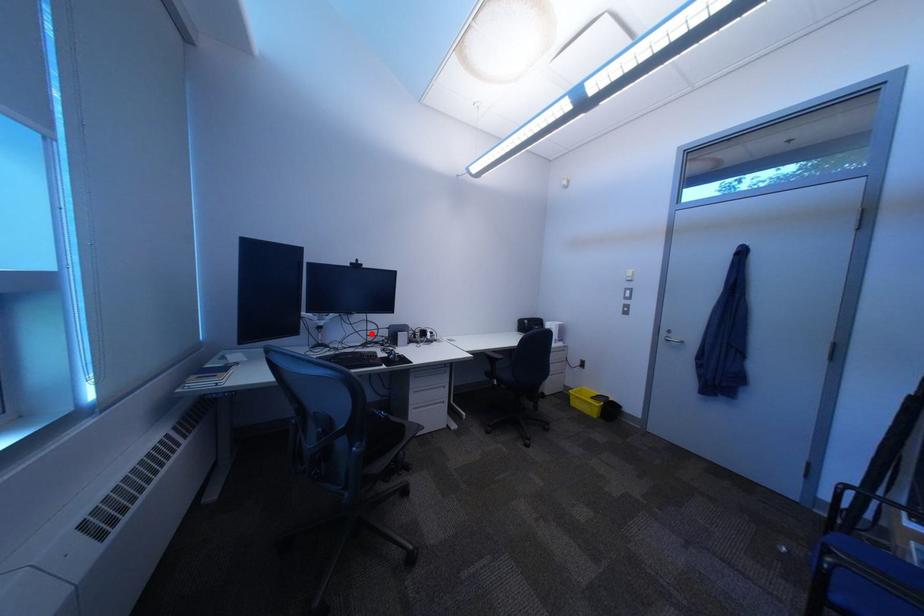
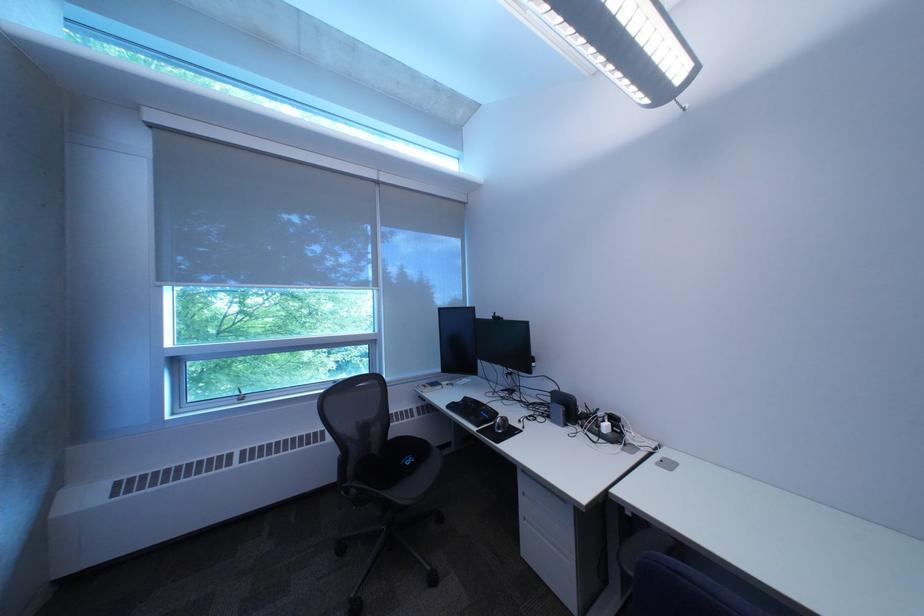
In the second image, find the point that corresponds to the highlighted location in the first image.

(532, 387)